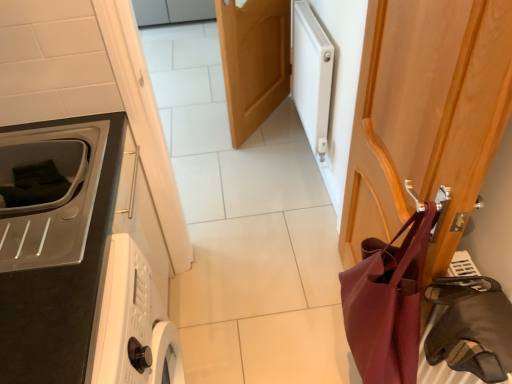
Question: Can you confirm if white matte radiator at upper right is positioned to the left of leather-like brown bag at right?

Choices:
 (A) no
 (B) yes

Answer: (B)

Question: Can you confirm if white matte radiator at upper right is positioned to the right of leather-like brown bag at right?

Choices:
 (A) yes
 (B) no

Answer: (B)

Question: Is white matte radiator at upper right further to the viewer compared to leather-like brown bag at right?

Choices:
 (A) yes
 (B) no

Answer: (A)

Question: Can you confirm if white matte radiator at upper right is thinner than leather-like brown bag at right?

Choices:
 (A) yes
 (B) no

Answer: (A)

Question: Considering the relative sizes of white matte radiator at upper right and leather-like brown bag at right in the image provided, is white matte radiator at upper right bigger than leather-like brown bag at right?

Choices:
 (A) no
 (B) yes

Answer: (B)

Question: Is white matte radiator at upper right placed right next to leather-like brown bag at right?

Choices:
 (A) no
 (B) yes

Answer: (A)

Question: Can you confirm if wooden door at center, which appears as the 1th door when viewed from the left, is taller than white matte radiator at upper right?

Choices:
 (A) yes
 (B) no

Answer: (A)

Question: Considering the relative sizes of wooden door at center, which is counted as the 1th door, starting from the back, and white matte radiator at upper right in the image provided, is wooden door at center, which is counted as the 1th door, starting from the back, shorter than white matte radiator at upper right?

Choices:
 (A) no
 (B) yes

Answer: (A)

Question: Is wooden door at center, which is counted as the 1th door, starting from the back, at the left side of white matte radiator at upper right?

Choices:
 (A) yes
 (B) no

Answer: (A)

Question: Does wooden door at center, marked as the second door in a right-to-left arrangement, have a lesser width compared to white matte radiator at upper right?

Choices:
 (A) no
 (B) yes

Answer: (A)

Question: Considering the relative sizes of wooden door at center, which appears as the 1th door when viewed from the left, and white matte radiator at upper right in the image provided, is wooden door at center, which appears as the 1th door when viewed from the left, bigger than white matte radiator at upper right?

Choices:
 (A) yes
 (B) no

Answer: (A)

Question: Is wooden door at center, marked as the second door in a right-to-left arrangement, next to white matte radiator at upper right?

Choices:
 (A) no
 (B) yes

Answer: (A)

Question: Does matte black microwave at left have a lesser height compared to white matte radiator at upper right?

Choices:
 (A) yes
 (B) no

Answer: (A)